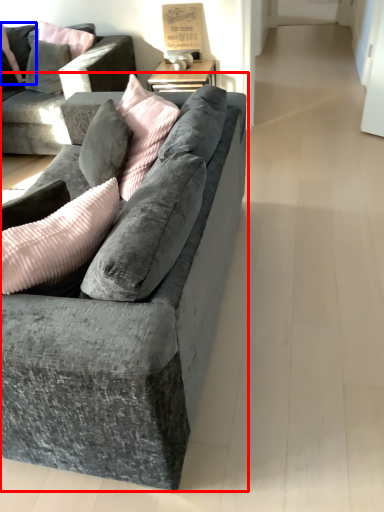
Question: Which object appears closest to the camera in this image, studio couch (highlighted by a red box) or pillow (highlighted by a blue box)?

Choices:
 (A) studio couch
 (B) pillow

Answer: (A)